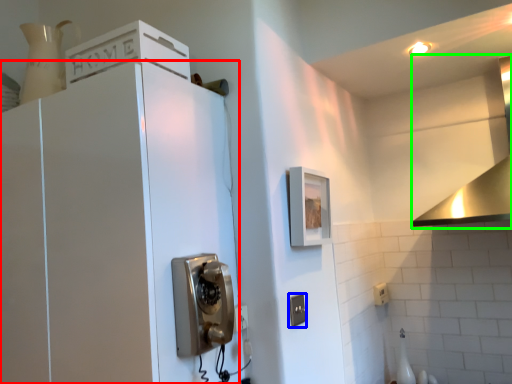
Question: Estimate the real-world distances between objects in this image. Which object is farther from cabinetry (highlighted by a red box), electric outlet (highlighted by a blue box) or vent (highlighted by a green box)?

Choices:
 (A) electric outlet
 (B) vent

Answer: (B)